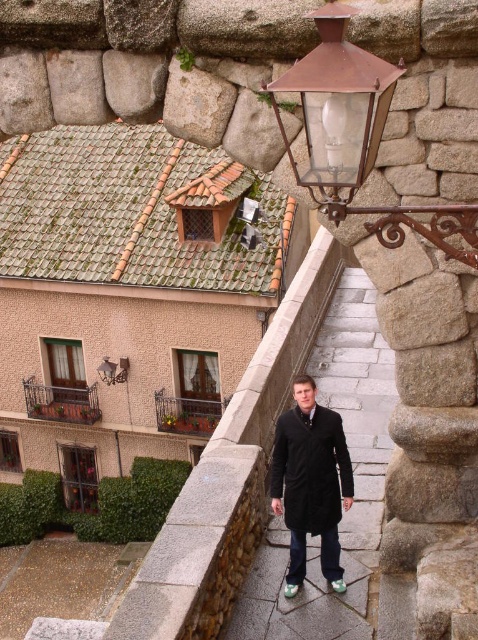
Who is positioned more to the right, rusty metal lantern at upper right or matte copper lantern at upper center?

From the viewer's perspective, rusty metal lantern at upper right appears more on the right side.

Is rusty metal lantern at upper right to the left of matte copper lantern at upper center from the viewer's perspective?

No, rusty metal lantern at upper right is not to the left of matte copper lantern at upper center.

The image size is (478, 640). Find the location of `rusty metal lantern at upper right`. rusty metal lantern at upper right is located at coordinates [x=358, y=136].

Looking at this image, is rusty metal lantern at upper right behind black matte coat at center?

No, it is in front of black matte coat at center.

Who is shorter, rusty metal lantern at upper right or black matte coat at center?

rusty metal lantern at upper right is shorter.

What do you see at coordinates (358, 136) in the screenshot? I see `rusty metal lantern at upper right` at bounding box center [358, 136].

At what (x,y) coordinates should I click in order to perform the action: click on rusty metal lantern at upper right. Please return your answer as a coordinate pair (x, y). Image resolution: width=478 pixels, height=640 pixels. Looking at the image, I should click on (358, 136).

Can you confirm if black matte coat at center is wider than rustic wrought iron balcony at lower left?

No, black matte coat at center is not wider than rustic wrought iron balcony at lower left.

Is black matte coat at center shorter than rustic wrought iron balcony at lower left?

Incorrect, black matte coat at center's height does not fall short of rustic wrought iron balcony at lower left's.

Is point (274, 492) closer to camera compared to point (44, 410)?

Yes, point (274, 492) is closer to viewer.

The image size is (478, 640). I want to click on black matte coat at center, so click(x=311, y=483).